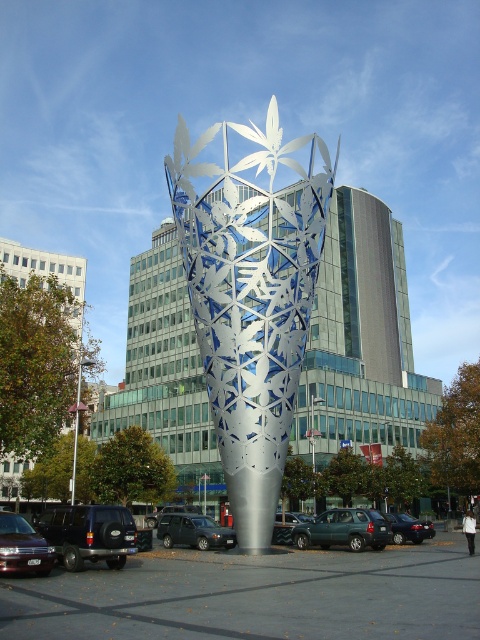
Question: Which of the following is the farthest from the observer?

Choices:
 (A) (422, 538)
 (B) (376, 522)
 (C) (310, 609)

Answer: (A)

Question: Which of the following is the closest to the observer?

Choices:
 (A) (108, 582)
 (B) (383, 536)
 (C) (391, 522)
 (D) (36, 557)

Answer: (D)

Question: Observing the image, what is the correct spatial positioning of black matte suv at lower left in reference to green matte suv at center?

Choices:
 (A) above
 (B) below

Answer: (A)

Question: Based on their relative distances, which object is farther from the shiny black sedan at lower left?

Choices:
 (A) shiny black sedan at lower right
 (B) green matte suv at center
 (C) metallic gray parking lot at center
 (D) black matte suv at lower left

Answer: (A)

Question: Where is metallic gray parking lot at center located in relation to dark gray metallic suv at center in the image?

Choices:
 (A) above
 (B) below

Answer: (A)

Question: Is metallic gray parking lot at center further to camera compared to shiny black sedan at lower left?

Choices:
 (A) no
 (B) yes

Answer: (A)